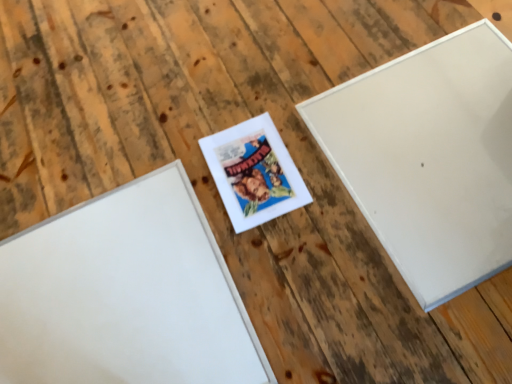
Question: From a real-world perspective, is white matte picture frame at upper right, the first picture frame positioned from the right, below white matte picture frame at center, positioned as the 3th picture frame in right-to-left order?

Choices:
 (A) no
 (B) yes

Answer: (A)

Question: Can you confirm if white matte picture frame at upper right, the first picture frame positioned from the right, is positioned to the right of white matte picture frame at center, positioned as the 3th picture frame in right-to-left order?

Choices:
 (A) yes
 (B) no

Answer: (A)

Question: Could you tell me if white matte picture frame at upper right, the first picture frame positioned from the right, is turned towards white matte picture frame at center, positioned as the 3th picture frame in right-to-left order?

Choices:
 (A) yes
 (B) no

Answer: (B)

Question: From the image's perspective, would you say white matte picture frame at upper right, the first picture frame positioned from the right, is shown under white matte picture frame at center, which appears as the 1th picture frame when viewed from the left?

Choices:
 (A) no
 (B) yes

Answer: (A)

Question: Does white matte picture frame at upper right, the first picture frame positioned from the right, appear on the left side of white matte picture frame at center, which appears as the 1th picture frame when viewed from the left?

Choices:
 (A) no
 (B) yes

Answer: (A)

Question: Are white matte picture frame at upper right, the first picture frame positioned from the right, and white matte picture frame at center, positioned as the 3th picture frame in right-to-left order, far apart?

Choices:
 (A) no
 (B) yes

Answer: (A)

Question: Is white matte picture frame at center, which appears as the 1th picture frame when viewed from the left, surrounding white matte picture frame at upper right, placed as the third picture frame when sorted from left to right?

Choices:
 (A) no
 (B) yes

Answer: (A)

Question: Can you confirm if white matte picture frame at center, which appears as the 1th picture frame when viewed from the left, is smaller than white matte picture frame at upper right, placed as the third picture frame when sorted from left to right?

Choices:
 (A) no
 (B) yes

Answer: (B)

Question: Is the position of white matte picture frame at center, positioned as the 3th picture frame in right-to-left order, more distant than that of white matte picture frame at upper right, the first picture frame positioned from the right?

Choices:
 (A) no
 (B) yes

Answer: (A)

Question: From the image's perspective, is white matte picture frame at center, which appears as the 1th picture frame when viewed from the left, over white matte picture frame at upper right, the first picture frame positioned from the right?

Choices:
 (A) yes
 (B) no

Answer: (B)

Question: Considering the relative sizes of white matte picture frame at center, positioned as the 3th picture frame in right-to-left order, and white matte picture frame at upper right, the first picture frame positioned from the right, in the image provided, is white matte picture frame at center, positioned as the 3th picture frame in right-to-left order, shorter than white matte picture frame at upper right, the first picture frame positioned from the right,?

Choices:
 (A) no
 (B) yes

Answer: (B)

Question: Does white matte picture frame at center, which appears as the 1th picture frame when viewed from the left, lie in front of white matte picture frame at upper right, the first picture frame positioned from the right?

Choices:
 (A) no
 (B) yes

Answer: (B)

Question: Is matte white picture frame at center, the second picture frame from the left, outside white matte picture frame at center, positioned as the 3th picture frame in right-to-left order?

Choices:
 (A) no
 (B) yes

Answer: (B)